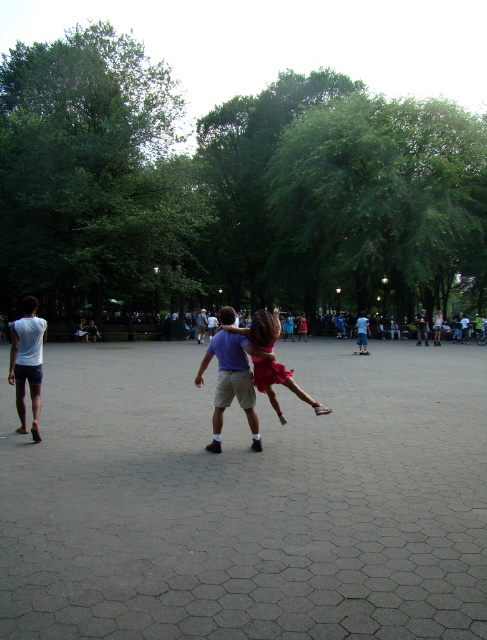
Question: Among these objects, which one is nearest to the camera?

Choices:
 (A) white matte shorts at left
 (B) matte purple shirt at center
 (C) matte red dress at center

Answer: (C)

Question: Does matte purple shirt at center have a larger size compared to matte red dress at center?

Choices:
 (A) no
 (B) yes

Answer: (B)

Question: Does white matte shorts at left appear over matte red dress at center?

Choices:
 (A) no
 (B) yes

Answer: (B)

Question: Estimate the real-world distances between objects in this image. Which object is farther from the matte red dress at center?

Choices:
 (A) matte purple shirt at center
 (B) white matte shorts at left

Answer: (B)

Question: Which point is closer to the camera?

Choices:
 (A) matte red dress at center
 (B) matte purple shirt at center

Answer: (A)

Question: Can you confirm if matte purple shirt at center is positioned to the left of matte red dress at center?

Choices:
 (A) no
 (B) yes

Answer: (B)